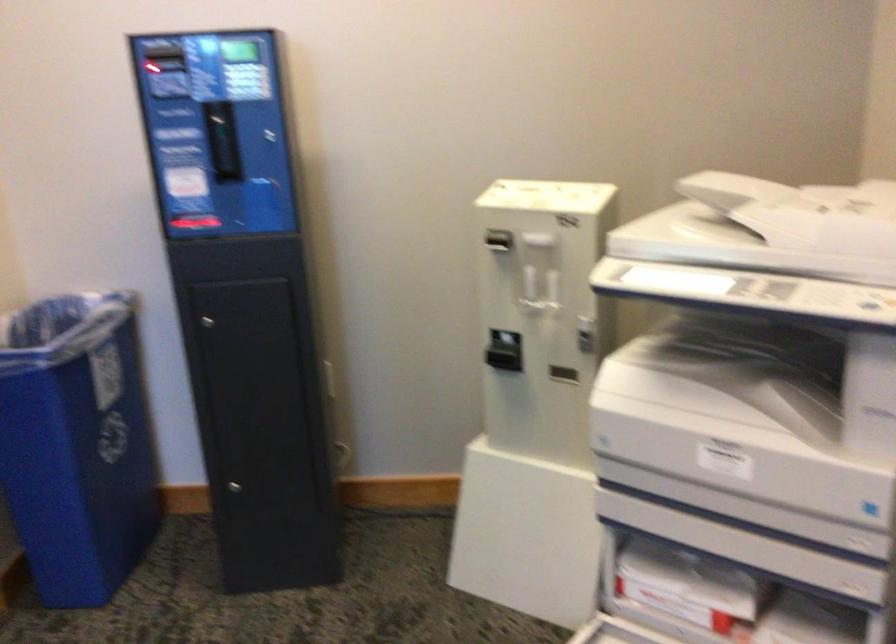
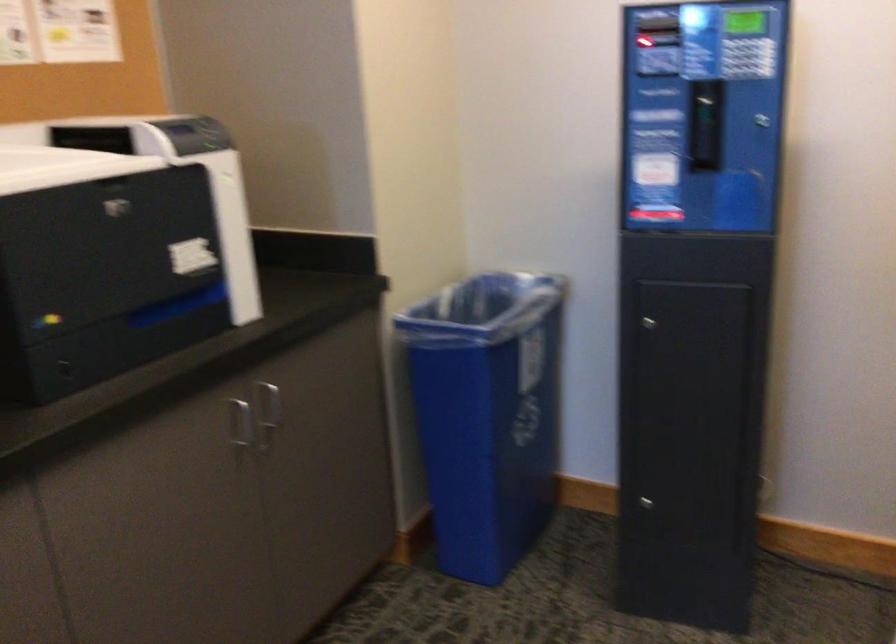
Locate, in the second image, the point that corresponds to (204,223) in the first image.

(655, 212)